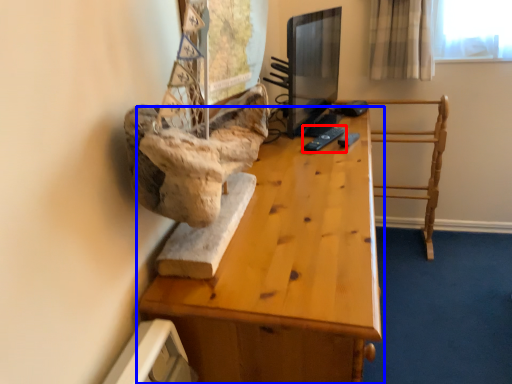
Question: Which point is further to the camera, remote (highlighted by a red box) or table (highlighted by a blue box)?

Choices:
 (A) remote
 (B) table

Answer: (A)